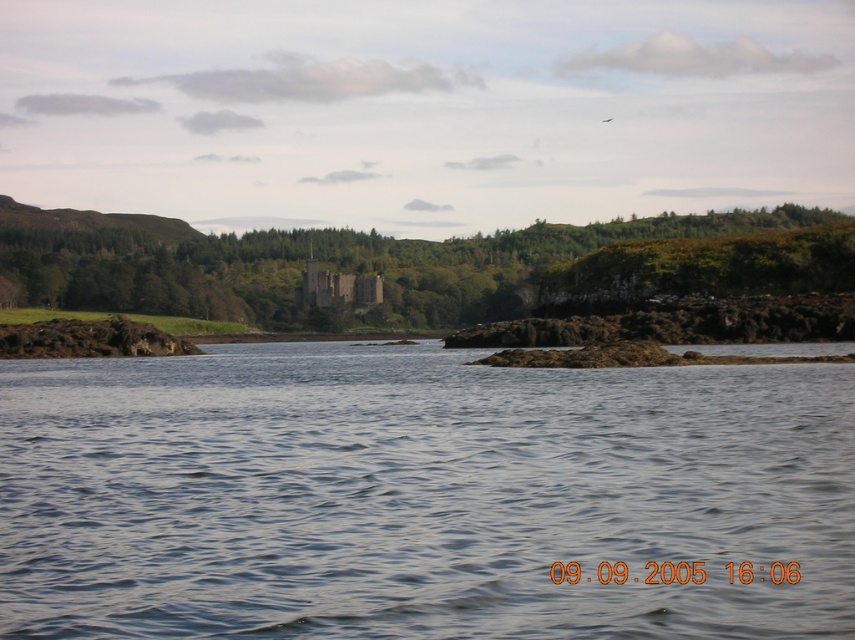
Question: Which point appears farthest from the camera in this image?

Choices:
 (A) (422, 465)
 (B) (121, 282)

Answer: (B)

Question: Does clear water at center have a greater width compared to green leafy tree at center?

Choices:
 (A) yes
 (B) no

Answer: (B)

Question: Is clear water at center to the right of green leafy tree at center from the viewer's perspective?

Choices:
 (A) no
 (B) yes

Answer: (B)

Question: Which point is farther to the camera?

Choices:
 (A) clear water at center
 (B) green leafy tree at center

Answer: (B)

Question: Is clear water at center to the left of green leafy tree at center from the viewer's perspective?

Choices:
 (A) yes
 (B) no

Answer: (B)